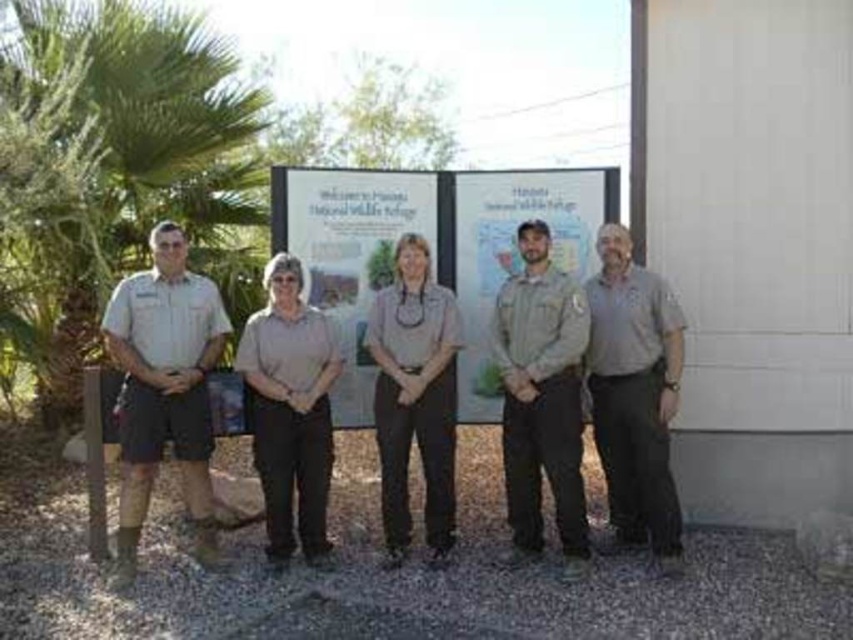
You are a photographer standing 10 feet away from the group and the signboard. You want to take a photo that includes both the khaki uniform pants at center and the matte brown sign at center in the same frame. Based on their positions, do you think they can both fit in the frame without moving anything?

The khaki uniform pants at center and matte brown sign at center are 33.81 inches apart from each other. Since they are only about 33.81 inches apart, which is roughly 2.8 feet, and you are 10 feet away, they should both fit within the frame without needing to adjust their positions.

You are a photographer trying to capture a group photo of the tan uniform at left and the matte brown sign at center. Based on their heights, which one should you adjust your camera focus on first to ensure both are in frame?

The tan uniform at left is taller than the matte brown sign at center, so you should focus on the tan uniform at left first to ensure both are in frame.